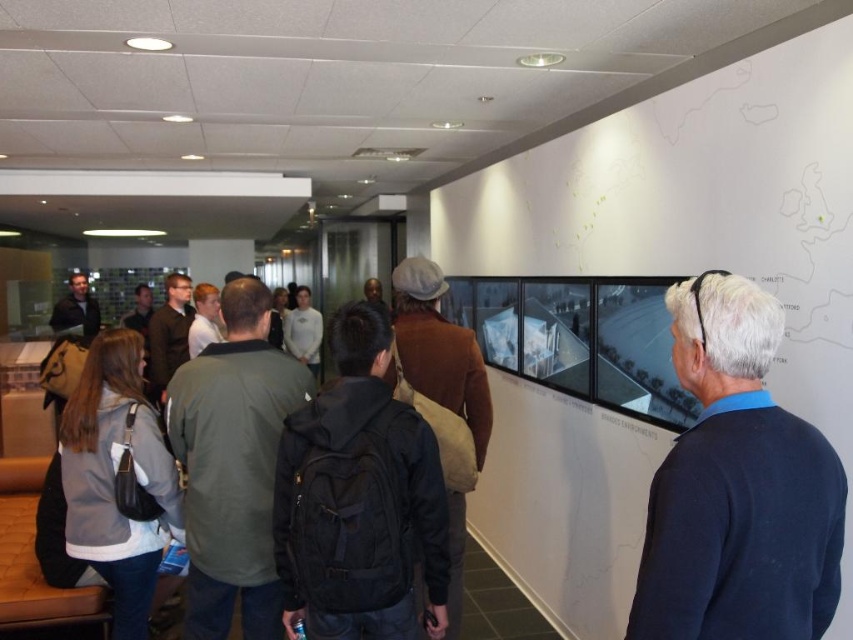
You are standing in the office space and see both the dark blue sweater at center and the brown woolen coat at center. Which item is nearer to you?

The dark blue sweater at center is closer to the viewer than the brown woolen coat at center.

You are at an event and need to locate two items displayed on a wall. The items are the dark blue sweater at center and the brown woolen coat at center. Which one is positioned to the right of the other?

The dark blue sweater at center is to the right of the brown woolen coat at center.

You are organizing a photo exhibition and need to ensure that all attendees can view the wall display comfortably. Considering the dark blue sweater at center and the brown woolen coat at center, which clothing item might block the view more if worn by someone standing in front of the display?

The dark blue sweater at center might block the view more than the brown woolen coat at center since it is wider.